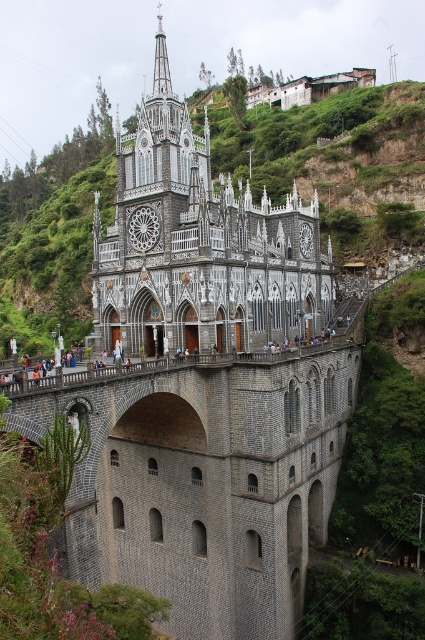
You are a tourist standing at the base of the hill looking up at the church. You need to reach the entrance located under the gray stone tower at center. Which path should you take to get there? The gray stone bridge at center or another path?

You should take the gray stone bridge at center because it is positioned under the gray stone tower at center, which is where the entrance is located.

You are standing at the base of the hill looking up at the church. You notice the gray stone bridge at center and the gray stone tower at center. Which structure is closer to you?

The gray stone bridge at center is closer to the viewer than the gray stone tower at center.

You are standing at the base of the hill where the gray stone bridge at center begins. You want to reach the church entrance, which is located at the end of the bridge. If your walking speed is 1.5 meters per second, how many seconds will it take you to reach the entrance?

The distance between you and the church entrance is 46.39 meters. At a walking speed of 1.5 meters per second, dividing the distance by the speed gives 46.39 divided by 1.5, which equals approximately 30.93 seconds. Therefore, it will take roughly 31 seconds to reach the entrance.